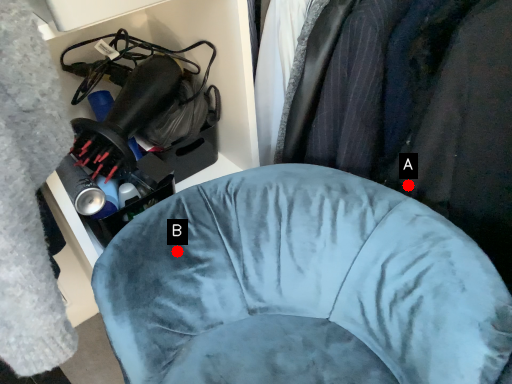
Question: Two points are circled on the image, labeled by A and B beside each circle. Which point is further to the camera?

Choices:
 (A) A is further
 (B) B is further

Answer: (A)